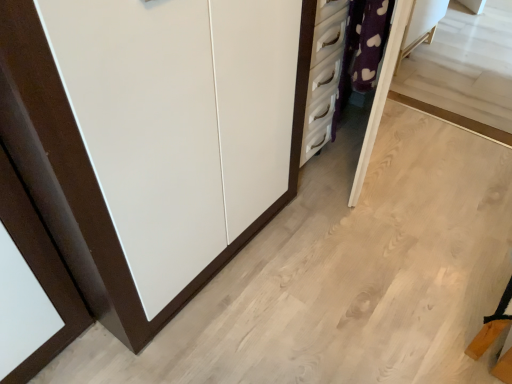
In order to click on purple fabric vanity at upper right in this screenshot , I will do `click(421, 25)`.

What is the approximate height of purple fabric vanity at upper right?

It is 44.37 centimeters.

The height and width of the screenshot is (384, 512). What do you see at coordinates (421, 25) in the screenshot?
I see `purple fabric vanity at upper right` at bounding box center [421, 25].

What do you see at coordinates (161, 134) in the screenshot? I see `white matte cupboard at left` at bounding box center [161, 134].

Where is `white matte cupboard at left`? white matte cupboard at left is located at coordinates (161, 134).

At what (x,y) coordinates should I click in order to perform the action: click on purple fabric vanity at upper right. Please return your answer as a coordinate pair (x, y). This screenshot has height=384, width=512. Looking at the image, I should click on (421, 25).

Is purple fabric vanity at upper right at the left side of white matte cupboard at left?

Incorrect, purple fabric vanity at upper right is not on the left side of white matte cupboard at left.

Is purple fabric vanity at upper right in front of or behind white matte cupboard at left in the image?

Clearly, purple fabric vanity at upper right is behind white matte cupboard at left.

Is point (445, 5) closer to viewer compared to point (226, 142)?

No, it is behind (226, 142).

From the image's perspective, is purple fabric vanity at upper right above or below white matte cupboard at left?

purple fabric vanity at upper right is situated higher than white matte cupboard at left in the image.

From a real-world perspective, between purple fabric vanity at upper right and white matte cupboard at left, who is vertically lower?

white matte cupboard at left is physically lower.

Is purple fabric vanity at upper right wider than white matte cupboard at left?

In fact, purple fabric vanity at upper right might be narrower than white matte cupboard at left.

Considering the sizes of objects purple fabric vanity at upper right and white matte cupboard at left in the image provided, who is taller, purple fabric vanity at upper right or white matte cupboard at left?

With more height is purple fabric vanity at upper right.

Considering the relative sizes of purple fabric vanity at upper right and white matte cupboard at left in the image provided, is purple fabric vanity at upper right smaller than white matte cupboard at left?

Yes, purple fabric vanity at upper right is smaller than white matte cupboard at left.

Does purple fabric vanity at upper right contain white matte cupboard at left?

No, white matte cupboard at left is not a part of purple fabric vanity at upper right.

Does purple fabric vanity at upper right touch white matte cupboard at left?

purple fabric vanity at upper right and white matte cupboard at left are clearly separated.

Does purple fabric vanity at upper right turn towards white matte cupboard at left?

No, purple fabric vanity at upper right is not turned towards white matte cupboard at left.

Can you tell me how much purple fabric vanity at upper right and white matte cupboard at left differ in facing direction?

They differ by 179 degrees in their facing directions.

At what (x,y) coordinates should I click in order to perform the action: click on cupboard that appears in front of the purple fabric vanity at upper right. Please return your answer as a coordinate pair (x, y). The width and height of the screenshot is (512, 384). Looking at the image, I should click on (161, 134).

Which object is positioned more to the right, white matte cupboard at left or purple fabric vanity at upper right?

purple fabric vanity at upper right.

Consider the image. Which is in front, white matte cupboard at left or purple fabric vanity at upper right?

Positioned in front is white matte cupboard at left.

Which point is more forward, (140, 1) or (400, 55)?

Positioned in front is point (140, 1).

Based on the photo, from the image's perspective, is white matte cupboard at left located above or below purple fabric vanity at upper right?

white matte cupboard at left is situated lower than purple fabric vanity at upper right in the image.

From a real-world perspective, relative to purple fabric vanity at upper right, is white matte cupboard at left vertically above or below?

white matte cupboard at left is below purple fabric vanity at upper right.

Which of these two, white matte cupboard at left or purple fabric vanity at upper right, is thinner?

With smaller width is purple fabric vanity at upper right.

Is white matte cupboard at left taller or shorter than purple fabric vanity at upper right?

white matte cupboard at left is shorter than purple fabric vanity at upper right.

Can you confirm if white matte cupboard at left is smaller than purple fabric vanity at upper right?

Incorrect, white matte cupboard at left is not smaller in size than purple fabric vanity at upper right.

Is purple fabric vanity at upper right inside white matte cupboard at left?

No, white matte cupboard at left does not contain purple fabric vanity at upper right.

Looking at this image, would you consider white matte cupboard at left to be distant from purple fabric vanity at upper right?

Absolutely, white matte cupboard at left is distant from purple fabric vanity at upper right.

Is white matte cupboard at left positioned with its back to purple fabric vanity at upper right?

white matte cupboard at left does not have its back to purple fabric vanity at upper right.

Can you tell me how much white matte cupboard at left and purple fabric vanity at upper right differ in facing direction?

179 degrees separate the facing orientations of white matte cupboard at left and purple fabric vanity at upper right.

The height and width of the screenshot is (384, 512). I want to click on cupboard below the purple fabric vanity at upper right (from the image's perspective), so tap(161, 134).

Where is `vanity that appears above the white matte cupboard at left (from the image's perspective)`? vanity that appears above the white matte cupboard at left (from the image's perspective) is located at coordinates (421, 25).

Where is `vanity above the white matte cupboard at left (from a real-world perspective)`? Image resolution: width=512 pixels, height=384 pixels. vanity above the white matte cupboard at left (from a real-world perspective) is located at coordinates 421,25.